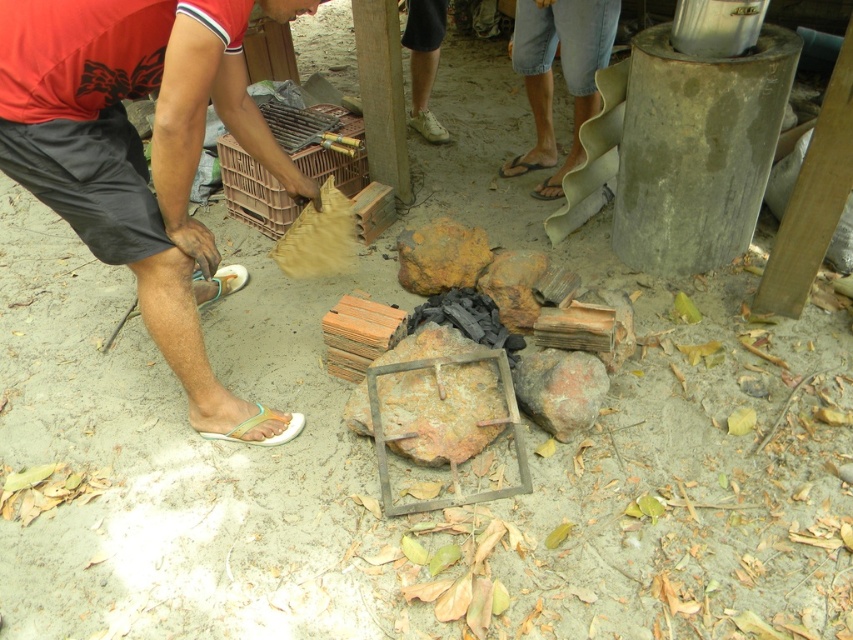
Who is taller, blue denim shorts at upper right or rusty metal rock at center?

With more height is blue denim shorts at upper right.

Based on the photo, is blue denim shorts at upper right shorter than rusty metal rock at center?

No, blue denim shorts at upper right is not shorter than rusty metal rock at center.

Describe the element at coordinates (561, 74) in the screenshot. The image size is (853, 640). I see `blue denim shorts at upper right` at that location.

In order to click on blue denim shorts at upper right in this screenshot , I will do `click(561, 74)`.

Is matte black sandal at lower left wider than yellowish rock at center?

Correct, the width of matte black sandal at lower left exceeds that of yellowish rock at center.

Is point (76, 227) farther from camera compared to point (430, 272)?

No.

Is point (178, 36) positioned before point (428, 276)?

Yes.

Where is `matte black sandal at lower left`? The width and height of the screenshot is (853, 640). matte black sandal at lower left is located at coordinates (138, 157).

Between point (595, 113) and point (398, 252), which one is positioned in front?

Point (398, 252) is more forward.

Between blue denim shorts at upper right and yellowish rock at center, which one has more height?

blue denim shorts at upper right is taller.

Does point (556, 44) come behind point (468, 268)?

Yes.

Identify the location of blue denim shorts at upper right. The width and height of the screenshot is (853, 640). (561, 74).